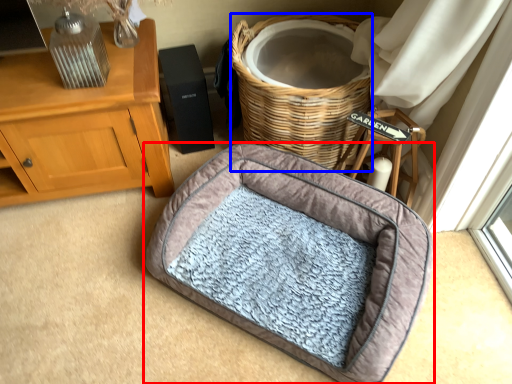
Question: Which point is closer to the camera, dog bed (highlighted by a red box) or basket (highlighted by a blue box)?

Choices:
 (A) dog bed
 (B) basket

Answer: (A)